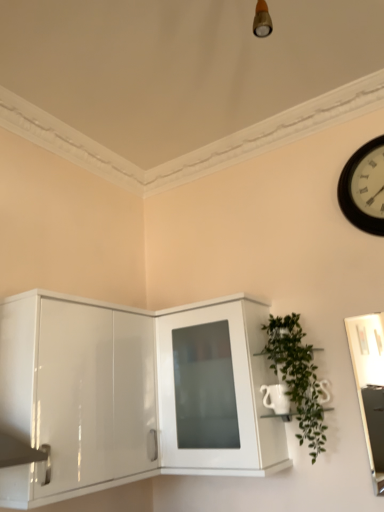
The image size is (384, 512). In order to click on black wooden clock at upper right in this screenshot , I will do `click(364, 187)`.

At what (x,y) coordinates should I click in order to perform the action: click on glossy white cabinet at lower left, the 1th cabinetry in the left-to-right sequence. Please return your answer as a coordinate pair (x, y). The width and height of the screenshot is (384, 512). Looking at the image, I should click on (126, 394).

Image resolution: width=384 pixels, height=512 pixels. What are the coordinates of `black wooden clock at upper right` in the screenshot? It's located at (364, 187).

Is glossy white cabinet at lower left, the 1th cabinetry in the left-to-right sequence, smaller than black wooden clock at upper right?

Incorrect, glossy white cabinet at lower left, the 1th cabinetry in the left-to-right sequence, is not smaller in size than black wooden clock at upper right.

From a real-world perspective, is glossy white cabinet at lower left, the 1th cabinetry in the left-to-right sequence, below black wooden clock at upper right?

Yes, from a real-world perspective, glossy white cabinet at lower left, the 1th cabinetry in the left-to-right sequence, is under black wooden clock at upper right.

Is glossy white cabinet at lower left, positioned as the second cabinetry in right-to-left order, situated inside black wooden clock at upper right or outside?

glossy white cabinet at lower left, positioned as the second cabinetry in right-to-left order, is located beyond the bounds of black wooden clock at upper right.

Considering the positions of objects glossy white cabinet at lower left, positioned as the second cabinetry in right-to-left order, and black wooden clock at upper right in the image provided, who is in front, glossy white cabinet at lower left, positioned as the second cabinetry in right-to-left order, or black wooden clock at upper right?

glossy white cabinet at lower left, positioned as the second cabinetry in right-to-left order, is more forward.

From the picture: Is green leafy plant at right positioned with its back to glossy white cabinet at lower left, the 1th cabinetry in the left-to-right sequence?

No, green leafy plant at right's orientation is not away from glossy white cabinet at lower left, the 1th cabinetry in the left-to-right sequence.

Considering the positions of objects green leafy plant at right and glossy white cabinet at lower left, positioned as the second cabinetry in right-to-left order, in the image provided, who is more to the left, green leafy plant at right or glossy white cabinet at lower left, positioned as the second cabinetry in right-to-left order,?

From the viewer's perspective, glossy white cabinet at lower left, positioned as the second cabinetry in right-to-left order, appears more on the left side.

In the image, is green leafy plant at right positioned in front of or behind glossy white cabinet at lower left, positioned as the second cabinetry in right-to-left order?

Visually, green leafy plant at right is located behind glossy white cabinet at lower left, positioned as the second cabinetry in right-to-left order.

This screenshot has height=512, width=384. I want to click on houseplant in front of the white glossy cabinet at center, which is the 1th cabinetry from right to left, so click(297, 377).

Considering the sizes of objects green leafy plant at right and white glossy cabinet at center, which is the 1th cabinetry from right to left, in the image provided, who is thinner, green leafy plant at right or white glossy cabinet at center, which is the 1th cabinetry from right to left,?

With smaller width is green leafy plant at right.

Considering the relative sizes of green leafy plant at right and white glossy cabinet at center, which is the 1th cabinetry from right to left, in the image provided, is green leafy plant at right taller than white glossy cabinet at center, which is the 1th cabinetry from right to left,?

In fact, green leafy plant at right may be shorter than white glossy cabinet at center, which is the 1th cabinetry from right to left.

Does glossy white cabinet at lower left, the 1th cabinetry in the left-to-right sequence, appear on the left side of green leafy plant at right?

Correct, you'll find glossy white cabinet at lower left, the 1th cabinetry in the left-to-right sequence, to the left of green leafy plant at right.

Identify the location of cabinetry that appears in front of the green leafy plant at right. (126, 394).

Considering the points (95, 304) and (309, 417), which point is in front, point (95, 304) or point (309, 417)?

Positioned in front is point (95, 304).

From the image's perspective, between glossy white cabinet at lower left, positioned as the second cabinetry in right-to-left order, and green leafy plant at right, which one is located above?

green leafy plant at right appears higher in the image.

Which of these two, white glossy cabinet at center, which is the second cabinetry in left-to-right order, or black wooden clock at upper right, stands taller?

white glossy cabinet at center, which is the second cabinetry in left-to-right order.

How much distance is there between white glossy cabinet at center, which is the second cabinetry in left-to-right order, and black wooden clock at upper right?

The distance of white glossy cabinet at center, which is the second cabinetry in left-to-right order, from black wooden clock at upper right is 37.04 inches.

Is white glossy cabinet at center, which is the 1th cabinetry from right to left, bigger than black wooden clock at upper right?

Indeed, white glossy cabinet at center, which is the 1th cabinetry from right to left, has a larger size compared to black wooden clock at upper right.

Between white glossy cabinet at center, which is the second cabinetry in left-to-right order, and black wooden clock at upper right, which one has smaller width?

Thinner between the two is black wooden clock at upper right.

How much distance is there between black wooden clock at upper right and white glossy cabinet at center, which is the 1th cabinetry from right to left?

They are 37.04 inches apart.

What's the angular difference between black wooden clock at upper right and white glossy cabinet at center, which is the second cabinetry in left-to-right order,'s facing directions?

The angle between the facing direction of black wooden clock at upper right and the facing direction of white glossy cabinet at center, which is the second cabinetry in left-to-right order, is 0.000194 degrees.

Is black wooden clock at upper right not close to white glossy cabinet at center, which is the second cabinetry in left-to-right order?

No, black wooden clock at upper right is not far from white glossy cabinet at center, which is the second cabinetry in left-to-right order.

Considering the relative sizes of black wooden clock at upper right and white glossy cabinet at center, which is the second cabinetry in left-to-right order, in the image provided, is black wooden clock at upper right wider than white glossy cabinet at center, which is the second cabinetry in left-to-right order,?

No.

Is black wooden clock at upper right located outside green leafy plant at right?

Yes, black wooden clock at upper right is located beyond the bounds of green leafy plant at right.

Can you confirm if black wooden clock at upper right is smaller than green leafy plant at right?

Yes.

Is black wooden clock at upper right at the left side of green leafy plant at right?

In fact, black wooden clock at upper right is to the right of green leafy plant at right.

The image size is (384, 512). I want to click on wall clock above the glossy white cabinet at lower left, positioned as the second cabinetry in right-to-left order (from the image's perspective), so click(x=364, y=187).

Find the location of `houseplant behind the glossy white cabinet at lower left, the 1th cabinetry in the left-to-right sequence`. houseplant behind the glossy white cabinet at lower left, the 1th cabinetry in the left-to-right sequence is located at coordinates pyautogui.click(x=297, y=377).

Looking at the image, which one is located closer to white glossy cabinet at center, which is the second cabinetry in left-to-right order, black wooden clock at upper right or glossy white cabinet at lower left, the 1th cabinetry in the left-to-right sequence?

glossy white cabinet at lower left, the 1th cabinetry in the left-to-right sequence, is closer to white glossy cabinet at center, which is the second cabinetry in left-to-right order.

Considering their positions, is white glossy cabinet at center, which is the 1th cabinetry from right to left, positioned further to green leafy plant at right than glossy white cabinet at lower left, positioned as the second cabinetry in right-to-left order?

The object further to green leafy plant at right is glossy white cabinet at lower left, positioned as the second cabinetry in right-to-left order.

When comparing their distances from black wooden clock at upper right, does white glossy cabinet at center, which is the second cabinetry in left-to-right order, or green leafy plant at right seem closer?

green leafy plant at right is positioned closer to the anchor black wooden clock at upper right.

When comparing their distances from glossy white cabinet at lower left, positioned as the second cabinetry in right-to-left order, does green leafy plant at right or black wooden clock at upper right seem further?

Among the two, black wooden clock at upper right is located further to glossy white cabinet at lower left, positioned as the second cabinetry in right-to-left order.

Estimate the real-world distances between objects in this image. Which object is closer to green leafy plant at right, black wooden clock at upper right or glossy white cabinet at lower left, the 1th cabinetry in the left-to-right sequence?

glossy white cabinet at lower left, the 1th cabinetry in the left-to-right sequence.

Estimate the real-world distances between objects in this image. Which object is closer to white glossy cabinet at center, which is the second cabinetry in left-to-right order, black wooden clock at upper right or green leafy plant at right?

Based on the image, green leafy plant at right appears to be nearer to white glossy cabinet at center, which is the second cabinetry in left-to-right order.

From the image, which object appears to be nearer to white glossy cabinet at center, which is the 1th cabinetry from right to left, green leafy plant at right or glossy white cabinet at lower left, the 1th cabinetry in the left-to-right sequence?

Among the two, glossy white cabinet at lower left, the 1th cabinetry in the left-to-right sequence, is located nearer to white glossy cabinet at center, which is the 1th cabinetry from right to left.

Looking at the image, which one is located closer to green leafy plant at right, black wooden clock at upper right or white glossy cabinet at center, which is the 1th cabinetry from right to left?

white glossy cabinet at center, which is the 1th cabinetry from right to left, is closer to green leafy plant at right.

Where is `cabinetry between glossy white cabinet at lower left, positioned as the second cabinetry in right-to-left order, and black wooden clock at upper right from left to right`? cabinetry between glossy white cabinet at lower left, positioned as the second cabinetry in right-to-left order, and black wooden clock at upper right from left to right is located at coordinates (216, 390).

Where is `houseplant between black wooden clock at upper right and white glossy cabinet at center, which is the second cabinetry in left-to-right order, vertically`? The width and height of the screenshot is (384, 512). houseplant between black wooden clock at upper right and white glossy cabinet at center, which is the second cabinetry in left-to-right order, vertically is located at coordinates (297, 377).

The height and width of the screenshot is (512, 384). What are the coordinates of `houseplant situated between glossy white cabinet at lower left, the 1th cabinetry in the left-to-right sequence, and black wooden clock at upper right from left to right` in the screenshot? It's located at (297, 377).

The image size is (384, 512). In order to click on cabinetry located between glossy white cabinet at lower left, the 1th cabinetry in the left-to-right sequence, and green leafy plant at right in the left-right direction in this screenshot , I will do `click(216, 390)`.